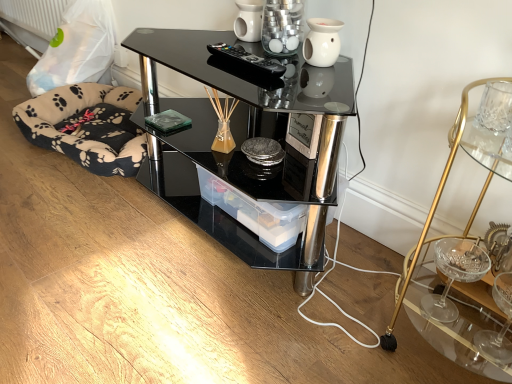
Question: Can you confirm if white ceramic vase at upper center is positioned to the left of gold metallic cocktail table at right?

Choices:
 (A) no
 (B) yes

Answer: (B)

Question: Is white ceramic vase at upper center in front of gold metallic cocktail table at right?

Choices:
 (A) no
 (B) yes

Answer: (A)

Question: Does white ceramic vase at upper center have a greater height compared to gold metallic cocktail table at right?

Choices:
 (A) no
 (B) yes

Answer: (A)

Question: Is gold metallic cocktail table at right completely or partially inside white ceramic vase at upper center?

Choices:
 (A) yes
 (B) no

Answer: (B)

Question: Can you confirm if white ceramic vase at upper center is positioned to the right of gold metallic cocktail table at right?

Choices:
 (A) yes
 (B) no

Answer: (B)

Question: Does white ceramic vase at upper center have a lesser height compared to gold metallic cocktail table at right?

Choices:
 (A) yes
 (B) no

Answer: (A)

Question: Is gold metallic cocktail table at right oriented away from black plastic remote at upper center?

Choices:
 (A) no
 (B) yes

Answer: (A)

Question: From the image's perspective, is gold metallic cocktail table at right located above black plastic remote at upper center?

Choices:
 (A) yes
 (B) no

Answer: (B)

Question: Can you confirm if gold metallic cocktail table at right is positioned to the left of black plastic remote at upper center?

Choices:
 (A) yes
 (B) no

Answer: (B)

Question: Could you tell me if gold metallic cocktail table at right is facing black plastic remote at upper center?

Choices:
 (A) no
 (B) yes

Answer: (A)

Question: Considering the relative sizes of gold metallic cocktail table at right and black plastic remote at upper center in the image provided, is gold metallic cocktail table at right taller than black plastic remote at upper center?

Choices:
 (A) yes
 (B) no

Answer: (A)

Question: Does gold metallic cocktail table at right have a lesser height compared to black plastic remote at upper center?

Choices:
 (A) yes
 (B) no

Answer: (B)

Question: Is transparent plastic container at center directly adjacent to gold metallic cocktail table at right?

Choices:
 (A) yes
 (B) no

Answer: (B)